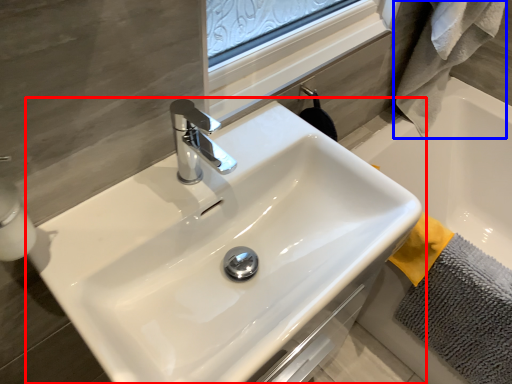
Question: Which object appears farthest to the camera in this image, sink (highlighted by a red box) or bath towel (highlighted by a blue box)?

Choices:
 (A) sink
 (B) bath towel

Answer: (B)